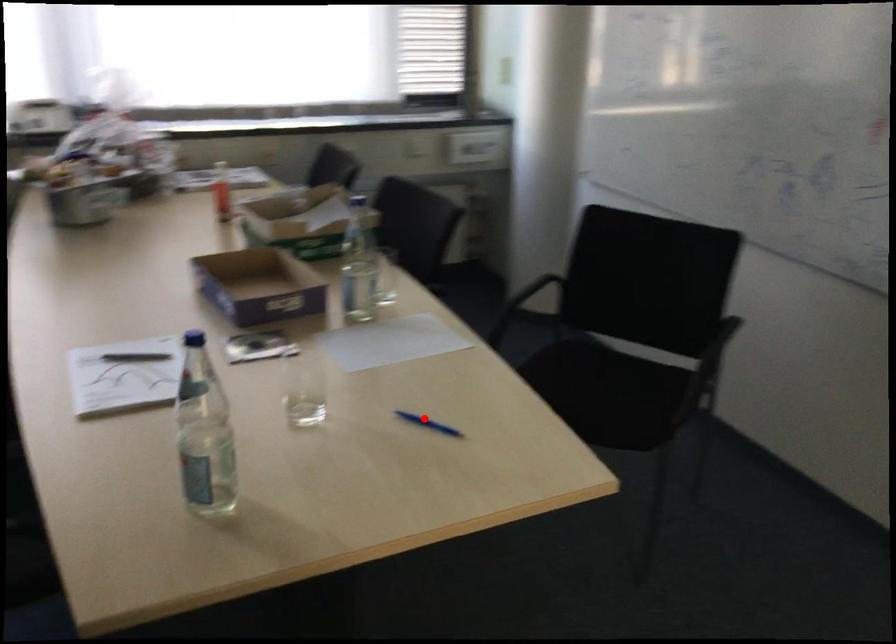
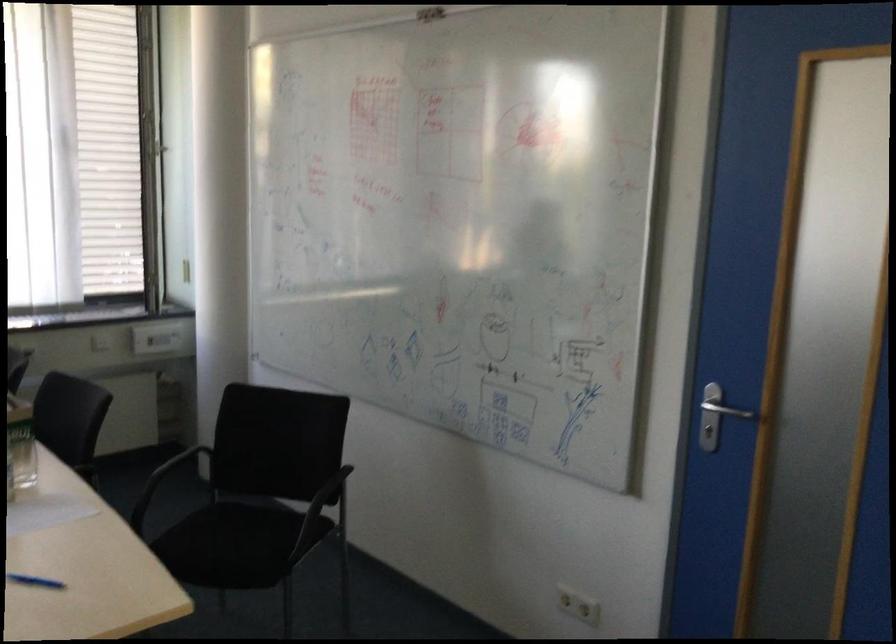
Question: A red point is marked in image1. In image2, is the corresponding 3D point closer to the camera or farther? Reply with the corresponding letter.

Choices:
 (A) The corresponding 3D point is closer.
 (B) The corresponding 3D point is farther.

Answer: (B)